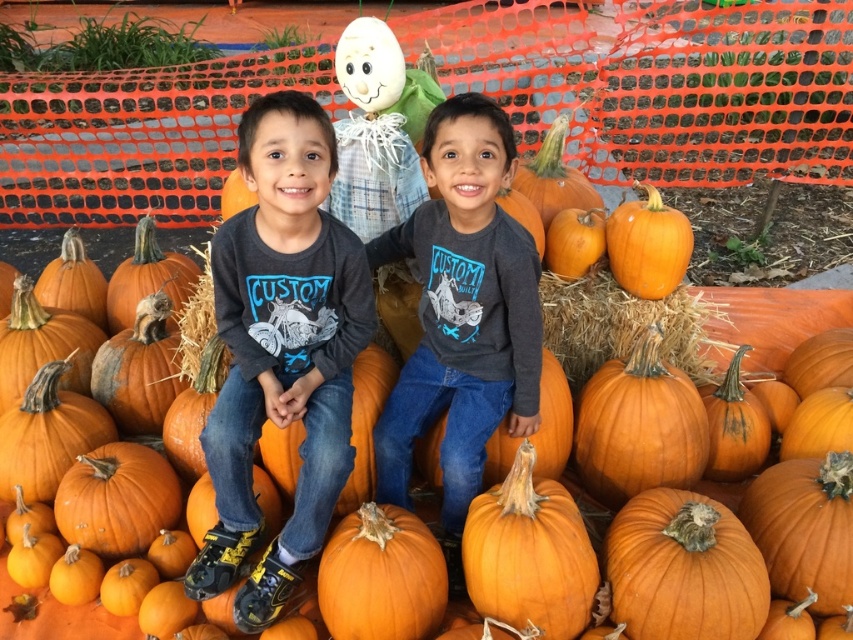
Question: Considering the real-world distances, which object is farthest from the orange matte pumpkin at center?

Choices:
 (A) orange matte pumpkin at right
 (B) dark gray cotton shirt at center
 (C) brown straw at center

Answer: (B)

Question: Which point is farther from the camera taking this photo?

Choices:
 (A) (459, 150)
 (B) (328, 310)
 (C) (134, 636)

Answer: (C)

Question: Is matte gray shirt at center positioned before dark gray cotton shirt at center?

Choices:
 (A) no
 (B) yes

Answer: (B)

Question: Which is farther from the orange matte pumpkin at right?

Choices:
 (A) brown straw at center
 (B) matte gray shirt at center

Answer: (B)

Question: Is orange matte pumpkin at center above brown straw at center?

Choices:
 (A) no
 (B) yes

Answer: (B)

Question: Is orange matte pumpkin at center above brown straw at center?

Choices:
 (A) yes
 (B) no

Answer: (A)